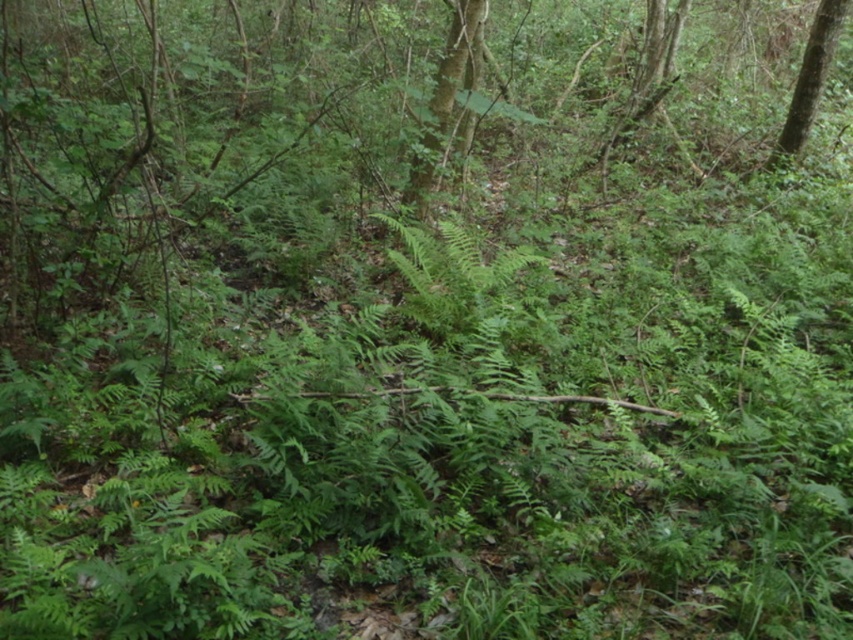
This screenshot has height=640, width=853. In order to click on green leafy tree at upper center in this screenshot , I will do `click(450, 99)`.

Is point (428, 170) positioned before point (810, 83)?

Yes, point (428, 170) is closer to viewer.

Which is in front, point (469, 129) or point (778, 144)?

Point (469, 129)

Locate an element on the screen. The image size is (853, 640). green leafy tree at upper center is located at coordinates coord(450,99).